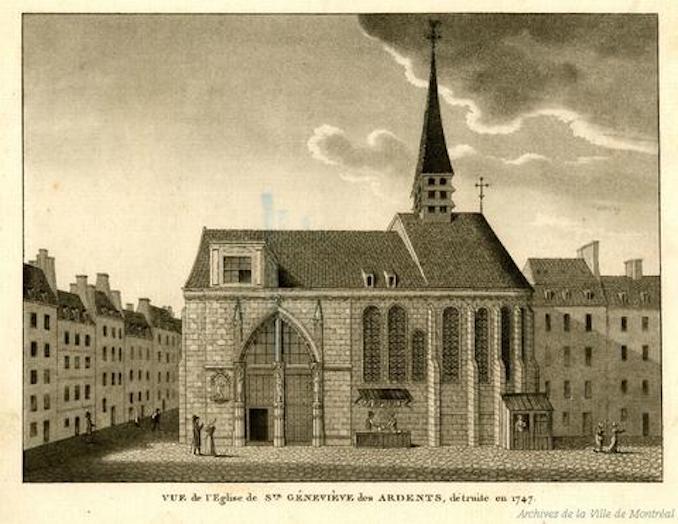
This screenshot has width=678, height=524. Identify the location of window. (370, 343).